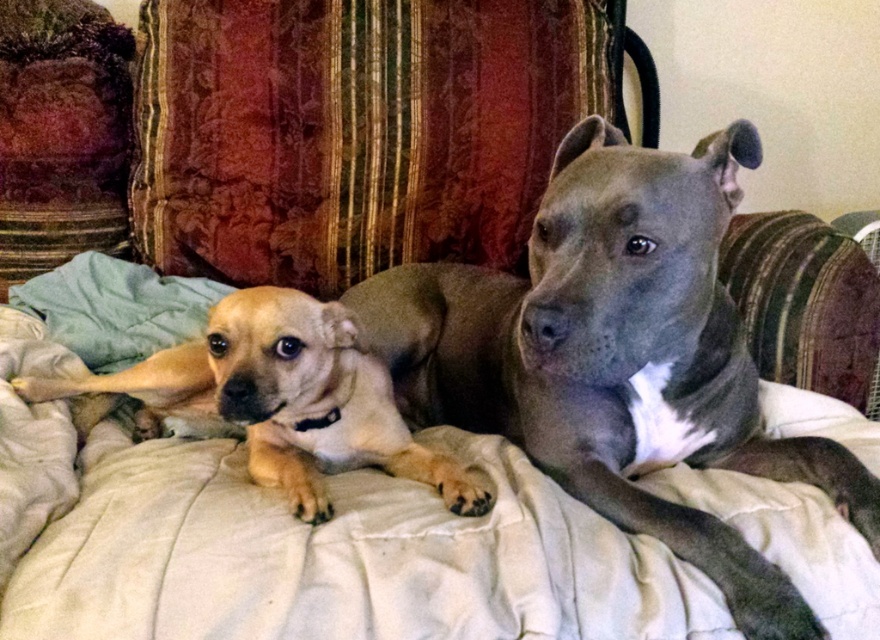
Can you confirm if smooth brown dog at center is bigger than light brown fur at center?

Yes, smooth brown dog at center is bigger than light brown fur at center.

Is smooth brown dog at center below light brown fur at center?

Incorrect, smooth brown dog at center is not positioned below light brown fur at center.

Describe the element at coordinates (617, 356) in the screenshot. I see `smooth brown dog at center` at that location.

What are the coordinates of `smooth brown dog at center` in the screenshot? It's located at (617, 356).

Does velvet cushion at upper center appear on the right side of light brown fur at center?

Correct, you'll find velvet cushion at upper center to the right of light brown fur at center.

Between point (189, 100) and point (222, 349), which one is positioned behind?

Positioned behind is point (189, 100).

Is point (356, 44) positioned behind point (225, 332)?

That is True.

This screenshot has width=880, height=640. In order to click on velvet cushion at upper center in this screenshot , I will do `click(352, 131)`.

From the picture: Is velvet cushion at upper center shorter than smooth brown dog at center?

No, velvet cushion at upper center is not shorter than smooth brown dog at center.

Is the position of velvet cushion at upper center less distant than that of smooth brown dog at center?

No, velvet cushion at upper center is behind smooth brown dog at center.

Locate an element on the screen. The image size is (880, 640). velvet cushion at upper center is located at coordinates (352, 131).

The height and width of the screenshot is (640, 880). Identify the location of velvet cushion at upper center. (352, 131).